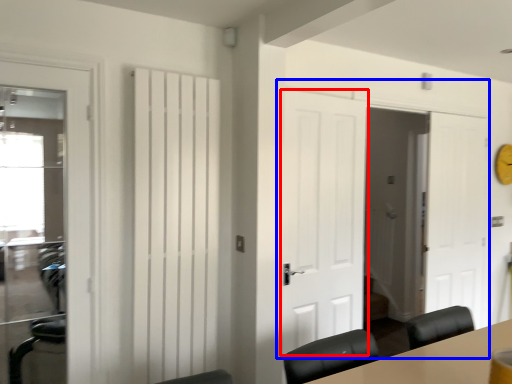
Question: Among these objects, which one is farthest to the camera, door (highlighted by a red box) or door (highlighted by a blue box)?

Choices:
 (A) door
 (B) door

Answer: (B)